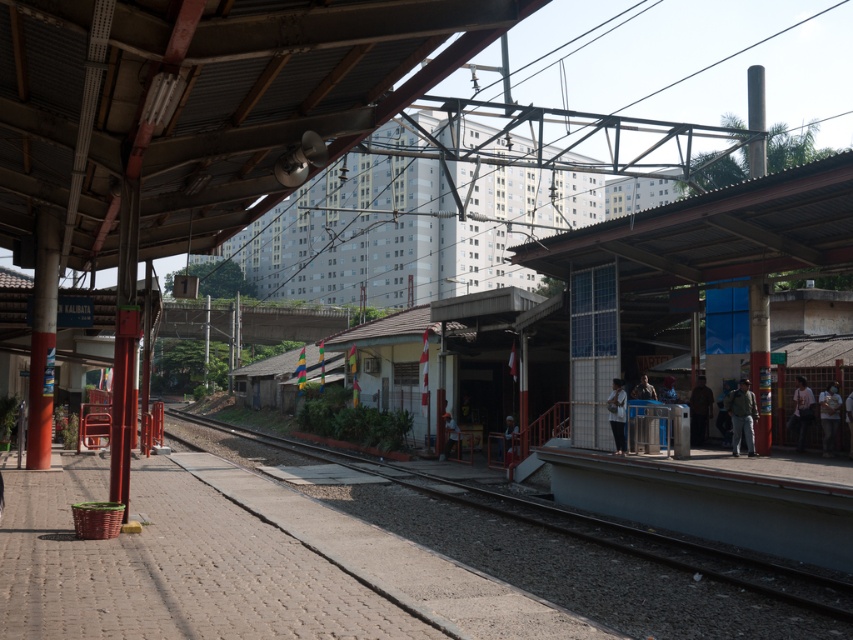
You are standing on the train station platform and see two points marked on the ground. The first point is at coordinates point [804,408] and the second point is at point [442,416]. Which point is closer to you?

Point [804,408] is closer to the viewer than point [442,416].

You are a traveler standing on the train station platform. You notice a dark brown leather jacket at right and a matte red helmet at center. Which item is smaller in size?

The dark brown leather jacket at right is smaller in size compared to the matte red helmet at center.